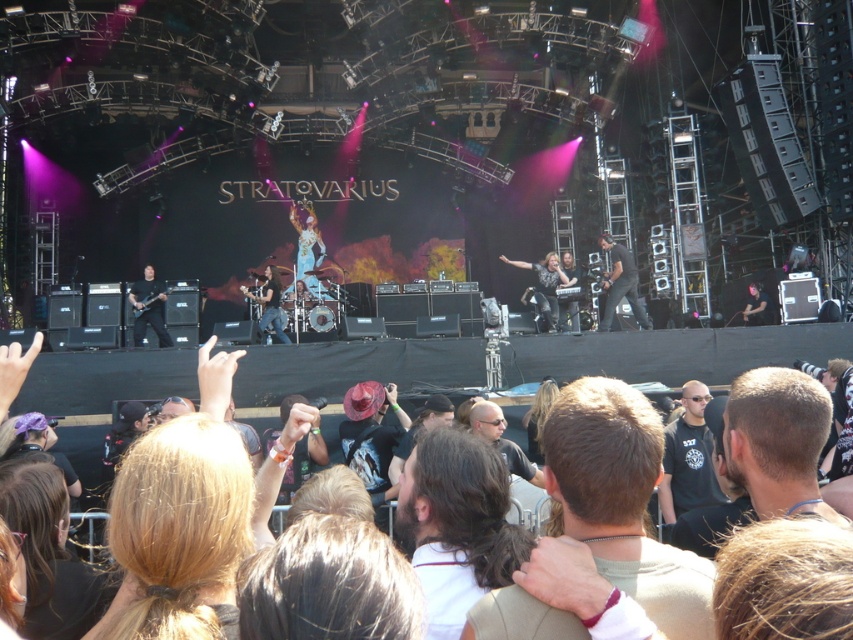
Which is above, black leather guitar at center or shiny black jacket at center?

shiny black jacket at center is higher up.

Can you confirm if black leather guitar at center is bigger than shiny black jacket at center?

Yes, black leather guitar at center is bigger than shiny black jacket at center.

Is point (634, 285) positioned behind point (544, 264)?

No.

Where is `black leather guitar at center`? This screenshot has height=640, width=853. black leather guitar at center is located at coordinates (619, 284).

Does blonde hair at lower left have a larger size compared to dark brown hair at lower center?

Actually, blonde hair at lower left might be smaller than dark brown hair at lower center.

Which is behind, point (229, 532) or point (122, 586)?

The point (229, 532) is more distant.

The width and height of the screenshot is (853, 640). What are the coordinates of `blonde hair at lower left` in the screenshot? It's located at (178, 531).

Is blonde hair at lower left positioned in front of black leather guitar at center?

Yes, blonde hair at lower left is in front of black leather guitar at center.

Is blonde hair at lower left bigger than black leather guitar at center?

Correct, blonde hair at lower left is larger in size than black leather guitar at center.

Who is more distant from viewer, (206, 561) or (606, 273)?

The point (606, 273) is more distant.

Where is `blonde hair at lower left`? The width and height of the screenshot is (853, 640). blonde hair at lower left is located at coordinates (178, 531).